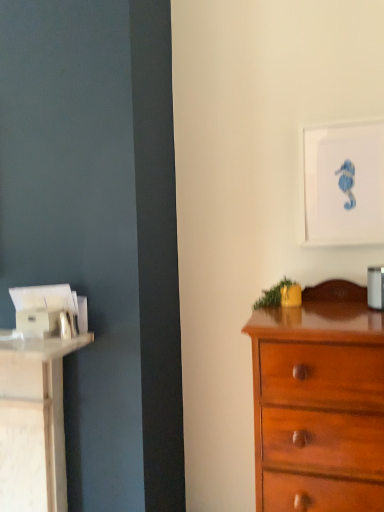
This screenshot has width=384, height=512. Describe the element at coordinates (319, 402) in the screenshot. I see `glossy wood chest of drawers at right` at that location.

Image resolution: width=384 pixels, height=512 pixels. Identify the location of glossy wood chest of drawers at right. (319, 402).

In order to face glossy wood chest of drawers at right, should I rotate leftwards or rightwards?

Rotate right and turn 17.229 degrees.

What is the approximate height of glossy wood chest of drawers at right?

It is 35.09 inches.

This screenshot has width=384, height=512. Identify the location of white matte picture frame at upper right. (343, 183).

What do you see at coordinates (343, 183) in the screenshot? I see `white matte picture frame at upper right` at bounding box center [343, 183].

In order to click on glossy wood chest of drawers at right in this screenshot , I will do `click(319, 402)`.

Which is more to the left, glossy wood chest of drawers at right or white matte picture frame at upper right?

Positioned to the left is glossy wood chest of drawers at right.

Considering the relative positions of glossy wood chest of drawers at right and white matte picture frame at upper right in the image provided, is glossy wood chest of drawers at right in front of white matte picture frame at upper right?

Yes, glossy wood chest of drawers at right is in front of white matte picture frame at upper right.

Is point (292, 417) closer or farther from the camera than point (379, 175)?

Point (292, 417).

From the image's perspective, between glossy wood chest of drawers at right and white matte picture frame at upper right, who is located below?

From the image's view, glossy wood chest of drawers at right is below.

From a real-world perspective, relative to white matte picture frame at upper right, is glossy wood chest of drawers at right vertically above or below?

glossy wood chest of drawers at right is situated lower than white matte picture frame at upper right in the real world.

Looking at this image, can you confirm if glossy wood chest of drawers at right is wider than white matte picture frame at upper right?

Yes, glossy wood chest of drawers at right is wider than white matte picture frame at upper right.

In terms of height, does glossy wood chest of drawers at right look taller or shorter compared to white matte picture frame at upper right?

Clearly, glossy wood chest of drawers at right is taller compared to white matte picture frame at upper right.

Can you confirm if glossy wood chest of drawers at right is bigger than white matte picture frame at upper right?

Yes, glossy wood chest of drawers at right is bigger than white matte picture frame at upper right.

Which is correct: glossy wood chest of drawers at right is inside white matte picture frame at upper right, or outside of it?

glossy wood chest of drawers at right is outside white matte picture frame at upper right.

Is glossy wood chest of drawers at right with white matte picture frame at upper right?

No, glossy wood chest of drawers at right is not touching white matte picture frame at upper right.

Could you tell me if glossy wood chest of drawers at right is facing white matte picture frame at upper right?

No, glossy wood chest of drawers at right is not turned towards white matte picture frame at upper right.

Looking at this image, how different are the orientations of glossy wood chest of drawers at right and white matte picture frame at upper right in degrees?

glossy wood chest of drawers at right and white matte picture frame at upper right are facing 3.57 degrees away from each other.

How distant is glossy wood chest of drawers at right from white matte picture frame at upper right?

18.76 inches.

Identify the location of chest of drawers on the left of the white matte picture frame at upper right. The image size is (384, 512). (319, 402).

Between white matte picture frame at upper right and glossy wood chest of drawers at right, which one appears on the right side from the viewer's perspective?

white matte picture frame at upper right is more to the right.

Is white matte picture frame at upper right positioned behind glossy wood chest of drawers at right?

Yes, the depth of white matte picture frame at upper right is greater than that of glossy wood chest of drawers at right.

Is point (304, 176) farther from viewer compared to point (346, 425)?

Yes.

From the image's perspective, which object appears higher, white matte picture frame at upper right or glossy wood chest of drawers at right?

From the image's view, white matte picture frame at upper right is above.

From a real-world perspective, is white matte picture frame at upper right over glossy wood chest of drawers at right?

Yes.

From the picture: Considering the sizes of objects white matte picture frame at upper right and glossy wood chest of drawers at right in the image provided, who is thinner, white matte picture frame at upper right or glossy wood chest of drawers at right?

white matte picture frame at upper right.

Between white matte picture frame at upper right and glossy wood chest of drawers at right, which one has less height?

Standing shorter between the two is white matte picture frame at upper right.

Looking at the image, does white matte picture frame at upper right seem bigger or smaller compared to glossy wood chest of drawers at right?

Clearly, white matte picture frame at upper right is smaller in size than glossy wood chest of drawers at right.

Which is correct: white matte picture frame at upper right is inside glossy wood chest of drawers at right, or outside of it?

white matte picture frame at upper right is outside glossy wood chest of drawers at right.

Is white matte picture frame at upper right placed right next to glossy wood chest of drawers at right?

No, white matte picture frame at upper right is not with glossy wood chest of drawers at right.

Is white matte picture frame at upper right facing away from glossy wood chest of drawers at right?

No.

Measure the distance between white matte picture frame at upper right and glossy wood chest of drawers at right.

They are 18.76 inches apart.

Where is `picture frame located behind the glossy wood chest of drawers at right`? Image resolution: width=384 pixels, height=512 pixels. picture frame located behind the glossy wood chest of drawers at right is located at coordinates (343, 183).

At what (x,y) coordinates should I click in order to perform the action: click on picture frame above the glossy wood chest of drawers at right (from the image's perspective). Please return your answer as a coordinate pair (x, y). Image resolution: width=384 pixels, height=512 pixels. Looking at the image, I should click on (343, 183).

Image resolution: width=384 pixels, height=512 pixels. Find the location of `the chest of drawers lying in front of the white matte picture frame at upper right`. the chest of drawers lying in front of the white matte picture frame at upper right is located at coordinates click(x=319, y=402).